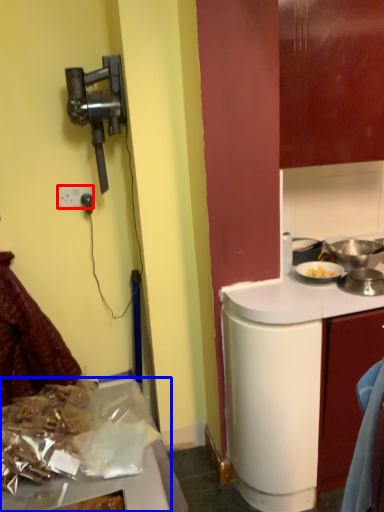
Question: Which object appears farthest to the camera in this image, power outlet (highlighted by a red box) or kitchen appliance (highlighted by a blue box)?

Choices:
 (A) power outlet
 (B) kitchen appliance

Answer: (A)